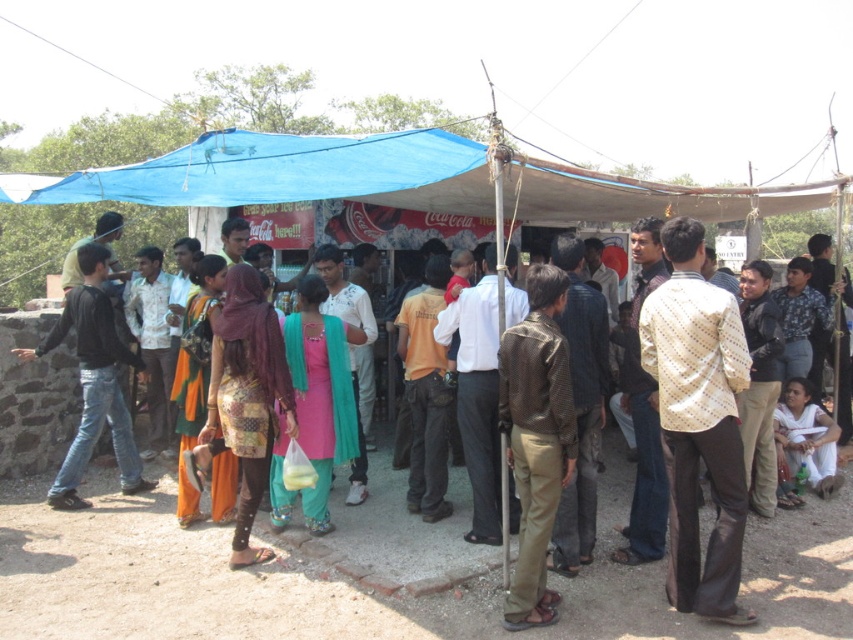
Where is the light beige dotted shirt at center located in the image?

The light beige dotted shirt at center is located at the 2D coordinates point (698, 420).

You are a photographer at the event and want to capture both the light beige dotted shirt at center and the brown textured shirt at center in a single frame. Which shirt should you focus on to ensure both are clearly visible?

You should focus on the light beige dotted shirt at center since it is larger in size than the brown textured shirt at center, making it easier to capture both in the frame.

From the picture: In the image, there is a point labeled at coordinates (698, 420). Based on the scene description, which object does this point most likely represent?

The point at coordinates (698, 420) corresponds to the light beige dotted shirt at center.